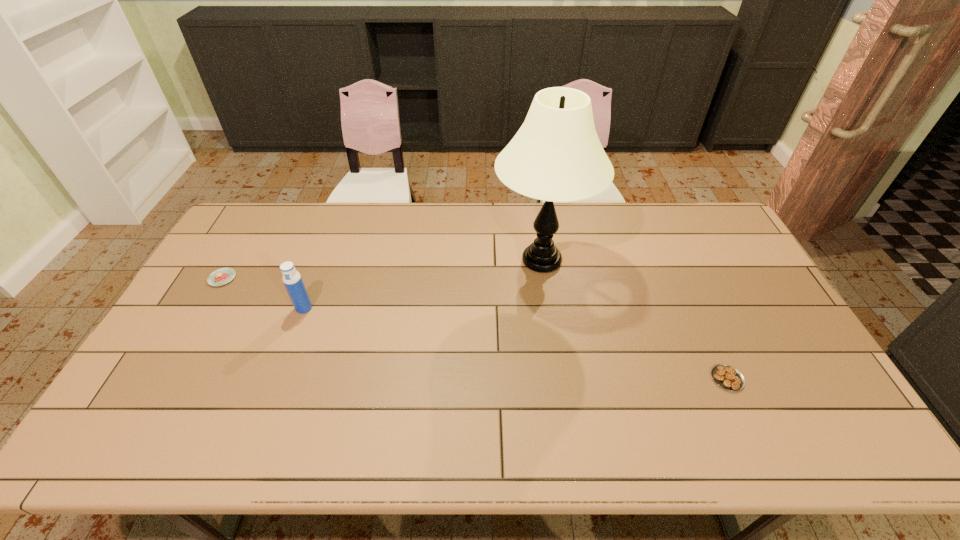
Identify the location of blank region between the lamp and the second nearest object. (422, 284).

The width and height of the screenshot is (960, 540). I want to click on free spot between the nearer pastry and the left pastry, so click(474, 328).

This screenshot has height=540, width=960. In order to click on vacant area that lies between the third farthest object and the tallest object in this screenshot , I will do `click(422, 284)`.

The image size is (960, 540). I want to click on free space between the nearer pastry and the farther pastry, so click(x=474, y=328).

What are the coordinates of `free space between the tallest object and the rightmost object` in the screenshot? It's located at (635, 319).

Where is `vacant area that lies between the farther pastry and the water bottle`? vacant area that lies between the farther pastry and the water bottle is located at coordinates (263, 293).

Locate an element on the screen. free spot between the water bottle and the rightmost object is located at coordinates (516, 343).

Where is `free space between the left pastry and the second nearest object`? The height and width of the screenshot is (540, 960). free space between the left pastry and the second nearest object is located at coordinates [263, 293].

Where is `unoccupied position between the farther pastry and the nearer pastry`? The image size is (960, 540). unoccupied position between the farther pastry and the nearer pastry is located at coordinates (474, 328).

Select which object appears as the second closest to the second object from left to right. Please provide its 2D coordinates. Your answer should be formatted as a tuple, i.e. [(x, y)], where the tuple contains the x and y coordinates of a point satisfying the conditions above.

[(556, 156)]